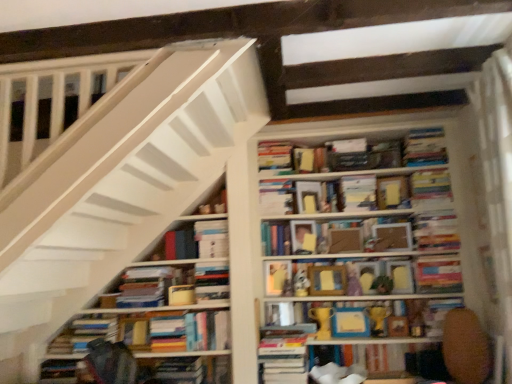
Question: Is hardcover book at center, the 12th paperback book in the left-to-right sequence, turned away from hardcover book at center, the eleventh book from the right?

Choices:
 (A) no
 (B) yes

Answer: (A)

Question: Can you confirm if hardcover book at center, marked as the 2th paperback book in a right-to-left arrangement, is wider than hardcover book at center, marked as the 3th book in a left-to-right arrangement?

Choices:
 (A) yes
 (B) no

Answer: (B)

Question: Considering the relative sizes of hardcover book at center, marked as the 2th paperback book in a right-to-left arrangement, and hardcover book at center, marked as the 3th book in a left-to-right arrangement, in the image provided, is hardcover book at center, marked as the 2th paperback book in a right-to-left arrangement, taller than hardcover book at center, marked as the 3th book in a left-to-right arrangement,?

Choices:
 (A) no
 (B) yes

Answer: (A)

Question: Is the depth of hardcover book at center, marked as the 2th paperback book in a right-to-left arrangement, greater than that of hardcover book at center, marked as the 3th book in a left-to-right arrangement?

Choices:
 (A) yes
 (B) no

Answer: (A)

Question: From a real-world perspective, is hardcover book at center, marked as the 2th paperback book in a right-to-left arrangement, over hardcover book at center, marked as the 3th book in a left-to-right arrangement?

Choices:
 (A) yes
 (B) no

Answer: (B)

Question: Is hardcover books at center, which ranks as the 9th book in right-to-left order, in front of or behind yellow matte trophy at center, the eighth book viewed from the left, in the image?

Choices:
 (A) behind
 (B) front

Answer: (A)

Question: Considering the positions of point (282, 147) and point (412, 329), is point (282, 147) closer or farther from the camera than point (412, 329)?

Choices:
 (A) closer
 (B) farther

Answer: (B)

Question: Is hardcover books at center, the 5th book when ordered from left to right, taller or shorter than yellow matte trophy at center, the eighth book viewed from the left?

Choices:
 (A) short
 (B) tall

Answer: (B)

Question: Considering the relative positions of hardcover books at center, the 5th book when ordered from left to right, and yellow matte trophy at center, the eighth book viewed from the left, in the image provided, is hardcover books at center, the 5th book when ordered from left to right, to the left or to the right of yellow matte trophy at center, the eighth book viewed from the left,?

Choices:
 (A) right
 (B) left

Answer: (B)

Question: From the image's perspective, relative to matte yellow paperback book at center, the 8th paperback book positioned from the left, is matte yellow paper at center, which is the 3th paperback book in right-to-left order, above or below?

Choices:
 (A) above
 (B) below

Answer: (A)

Question: Considering the positions of matte yellow paper at center, the 11th paperback book from the left, and matte yellow paperback book at center, which is the 6th paperback book from right to left, in the image, is matte yellow paper at center, the 11th paperback book from the left, bigger or smaller than matte yellow paperback book at center, which is the 6th paperback book from right to left,?

Choices:
 (A) small
 (B) big

Answer: (A)

Question: Visually, is matte yellow paper at center, the 11th paperback book from the left, positioned to the left or to the right of matte yellow paperback book at center, which is the 6th paperback book from right to left?

Choices:
 (A) left
 (B) right

Answer: (B)

Question: From their relative heights in the image, would you say matte yellow paper at center, the 11th paperback book from the left, is taller or shorter than matte yellow paperback book at center, the 8th paperback book positioned from the left?

Choices:
 (A) short
 (B) tall

Answer: (B)

Question: In terms of size, does hardcover book at lower right, arranged as the 10th book when viewed from the left, appear bigger or smaller than white paper at center, marked as the 3th paperback book in a left-to-right arrangement?

Choices:
 (A) small
 (B) big

Answer: (B)

Question: Considering the positions of point (398, 349) and point (273, 185), is point (398, 349) closer or farther from the camera than point (273, 185)?

Choices:
 (A) farther
 (B) closer

Answer: (B)